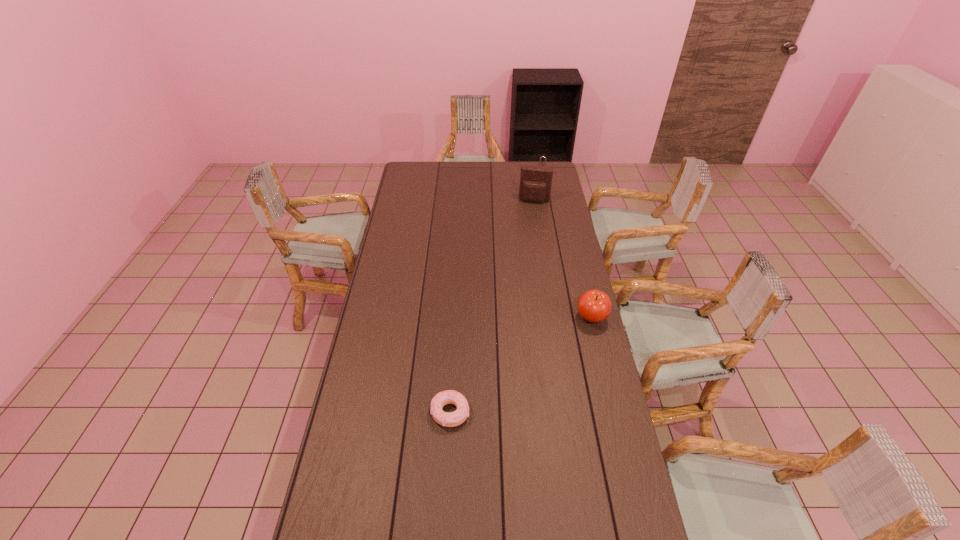
You are a GUI agent. You are given a task and a screenshot of the screen. Output one action in this format:
    pyautogui.click(x=<x>, y=<y>)
    Task: Click on the vacant space at the far edge of the desktop
    Image resolution: width=960 pixels, height=540 pixels.
    Given the screenshot: What is the action you would take?
    pyautogui.click(x=460, y=165)

What are the coordinates of `free space at the left edge of the desktop` in the screenshot? It's located at (369, 318).

The image size is (960, 540). I want to click on vacant area at the right edge, so click(x=578, y=448).

Where is `free space at the far left corner`? The height and width of the screenshot is (540, 960). free space at the far left corner is located at coordinates pos(432,165).

The image size is (960, 540). What are the coordinates of `unoccupied area between the farthest object and the shortest object` in the screenshot? It's located at (495, 295).

Where is `blank region between the doughnut and the third farthest object`? Image resolution: width=960 pixels, height=540 pixels. blank region between the doughnut and the third farthest object is located at coordinates (520, 365).

You are a GUI agent. You are given a task and a screenshot of the screen. Output one action in this format:
    pyautogui.click(x=<x>, y=<y>)
    Task: Click on the vacant point located between the tallest object and the nearest object
    
    Given the screenshot: What is the action you would take?
    pyautogui.click(x=492, y=307)

At what (x,y) coordinates should I click in order to perform the action: click on free spot between the pouch and the rightmost object. Please return your answer as a coordinate pair (x, y). Looking at the image, I should click on (563, 259).

At what (x,y) coordinates should I click in order to perform the action: click on free point between the apple and the leftmost object. Please return your answer as a coordinate pair (x, y). Image resolution: width=960 pixels, height=540 pixels. Looking at the image, I should click on (520, 365).

Find the location of a particular element. vacant region between the farthest object and the rightmost object is located at coordinates (566, 247).